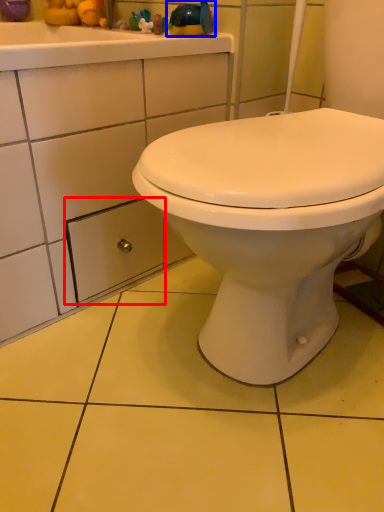
Question: Which of the following is the farthest to the observer, drawer (highlighted by a red box) or toy (highlighted by a blue box)?

Choices:
 (A) drawer
 (B) toy

Answer: (B)